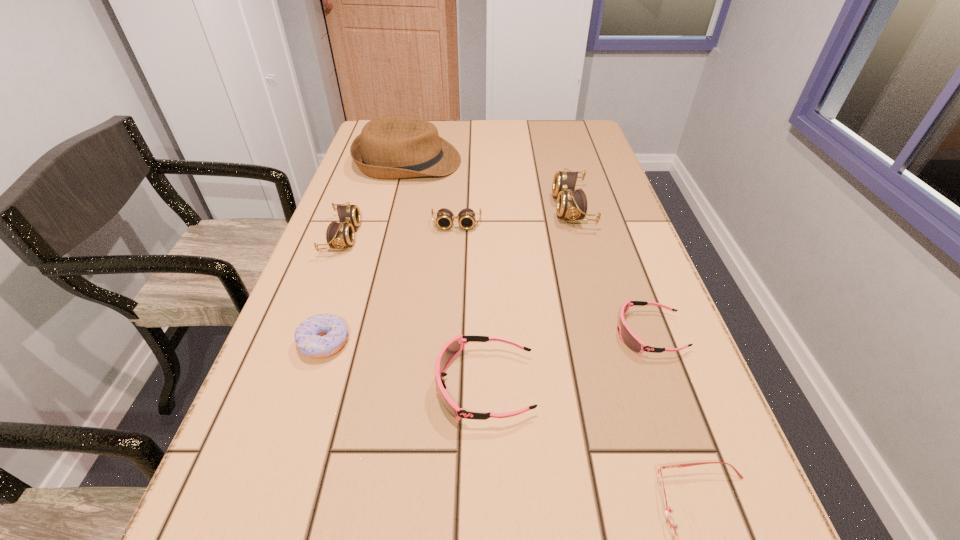
Where is `free space at the left edge of the desktop`? The width and height of the screenshot is (960, 540). free space at the left edge of the desktop is located at coordinates [x=301, y=442].

Where is `free region at the right edge of the desktop`? free region at the right edge of the desktop is located at coordinates (696, 438).

The width and height of the screenshot is (960, 540). What are the coordinates of `blank area at the far right corner` in the screenshot? It's located at (551, 132).

Where is `vacant area that lies between the bigger pink goggles and the smallest brown goggles`? The height and width of the screenshot is (540, 960). vacant area that lies between the bigger pink goggles and the smallest brown goggles is located at coordinates (470, 305).

Where is `vacant area that lies between the rightmost brown goggles and the left pink goggles`? The height and width of the screenshot is (540, 960). vacant area that lies between the rightmost brown goggles and the left pink goggles is located at coordinates (528, 296).

The width and height of the screenshot is (960, 540). I want to click on vacant space in between the rightmost brown goggles and the fedora, so click(x=490, y=185).

Where is `free spot between the second brown goggles from left to right and the fedora`? This screenshot has width=960, height=540. free spot between the second brown goggles from left to right and the fedora is located at coordinates (432, 193).

At what (x,y) coordinates should I click in order to perform the action: click on empty location between the bigger pink goggles and the biggest brown goggles. Please return your answer as a coordinate pair (x, y). This screenshot has width=960, height=540. Looking at the image, I should click on 528,296.

Locate an element on the screen. blank region between the leftmost goggles and the bigger pink goggles is located at coordinates (414, 310).

Image resolution: width=960 pixels, height=540 pixels. I want to click on vacant area that lies between the second brown goggles from left to right and the brown fedora, so click(x=432, y=193).